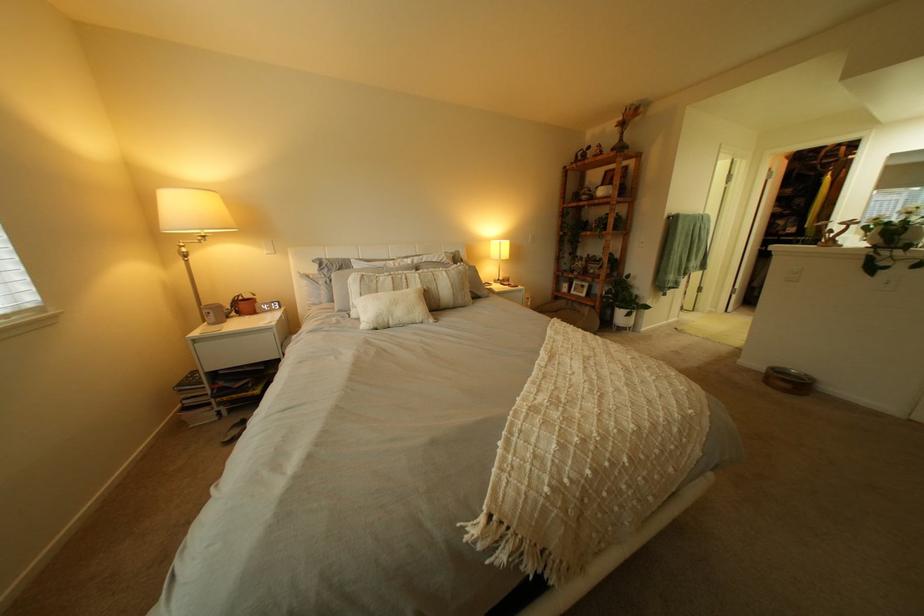
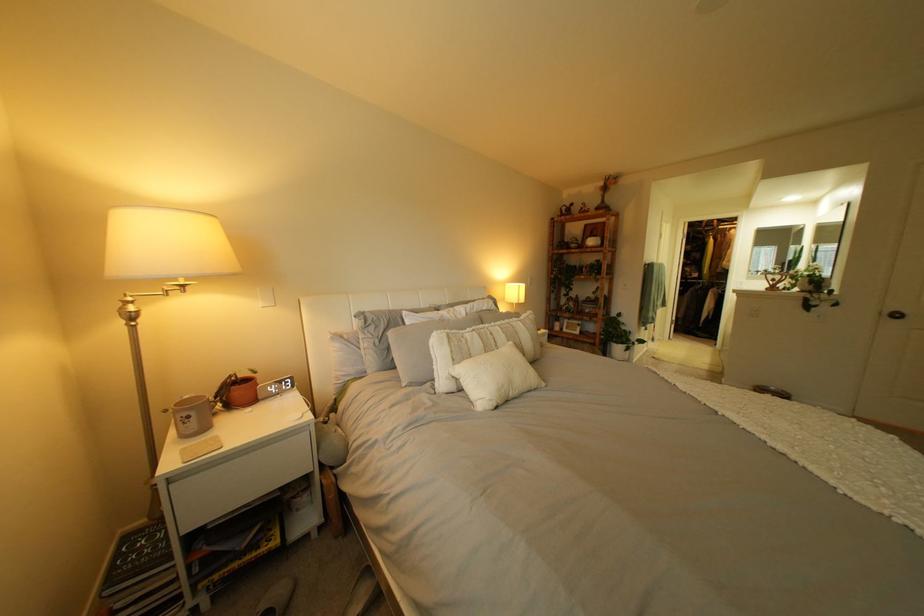
Where in the second image is the point corresponding to pixel 434 283 from the first image?

(518, 337)